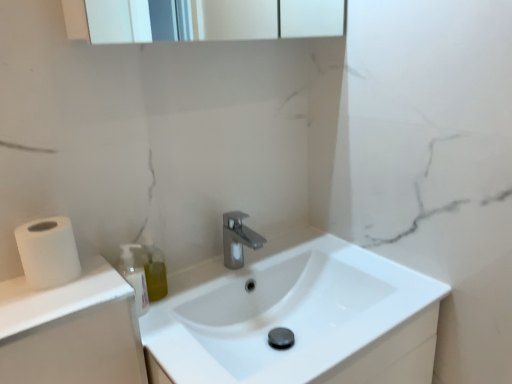
Question: Is satin nickel faucet at center bigger than white matte toilet paper at left?

Choices:
 (A) yes
 (B) no

Answer: (A)

Question: Is satin nickel faucet at center closer to camera compared to white matte toilet paper at left?

Choices:
 (A) no
 (B) yes

Answer: (A)

Question: Does satin nickel faucet at center have a greater height compared to white matte toilet paper at left?

Choices:
 (A) yes
 (B) no

Answer: (A)

Question: From a real-world perspective, does satin nickel faucet at center sit lower than white matte toilet paper at left?

Choices:
 (A) yes
 (B) no

Answer: (A)

Question: Is satin nickel faucet at center at the left side of white matte toilet paper at left?

Choices:
 (A) yes
 (B) no

Answer: (B)

Question: Is satin nickel faucet at center facing towards white matte toilet paper at left?

Choices:
 (A) no
 (B) yes

Answer: (A)

Question: Is white matte toilet paper at left taller than white glossy sink at center?

Choices:
 (A) yes
 (B) no

Answer: (B)

Question: Are white matte toilet paper at left and white glossy sink at center located far from each other?

Choices:
 (A) no
 (B) yes

Answer: (A)

Question: Considering the relative sizes of white matte toilet paper at left and white glossy sink at center in the image provided, is white matte toilet paper at left wider than white glossy sink at center?

Choices:
 (A) yes
 (B) no

Answer: (B)

Question: Is white matte toilet paper at left outside white glossy sink at center?

Choices:
 (A) yes
 (B) no

Answer: (A)

Question: From a real-world perspective, does white matte toilet paper at left sit lower than white glossy sink at center?

Choices:
 (A) yes
 (B) no

Answer: (B)

Question: Does white matte toilet paper at left come in front of white glossy sink at center?

Choices:
 (A) no
 (B) yes

Answer: (A)

Question: Is white glossy sink at center wider than satin nickel faucet at center?

Choices:
 (A) no
 (B) yes

Answer: (B)